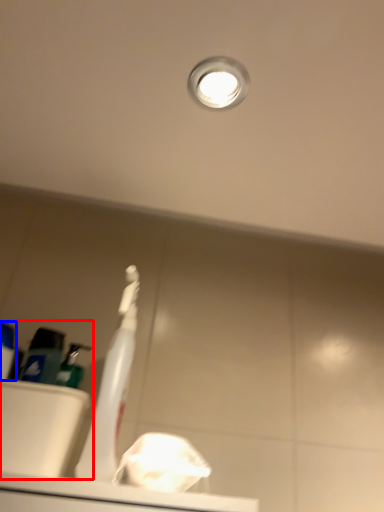
Question: Which of the following is the closest to the observer, sink (highlighted by a red box) or toiletry (highlighted by a blue box)?

Choices:
 (A) sink
 (B) toiletry

Answer: (B)